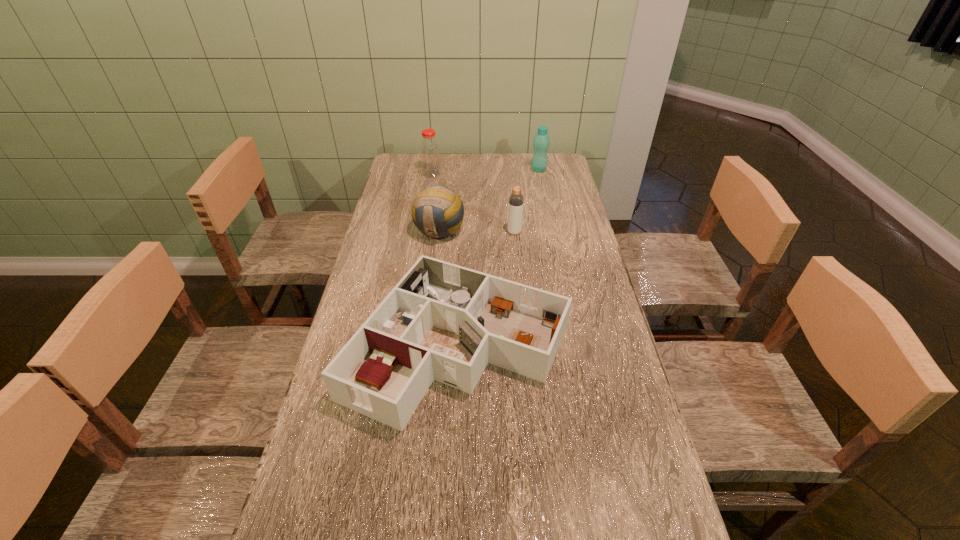
Identify the location of the leftmost bottle. Image resolution: width=960 pixels, height=540 pixels. (430, 156).

The height and width of the screenshot is (540, 960). I want to click on the rightmost bottle, so click(x=541, y=142).

Identify the location of the nearest bottle. The height and width of the screenshot is (540, 960). (516, 200).

At what (x,y) coordinates should I click in order to perform the action: click on volleyball. Please return your answer as a coordinate pair (x, y). Looking at the image, I should click on (438, 212).

Where is `the nearest object`? the nearest object is located at coordinates (444, 322).

At what (x,y) coordinates should I click in order to perform the action: click on dollhouse. Please return your answer as a coordinate pair (x, y). Image resolution: width=960 pixels, height=540 pixels. Looking at the image, I should click on click(x=444, y=322).

Identify the location of vacant position located 0.350m on the right of the leftmost bottle. (523, 174).

Image resolution: width=960 pixels, height=540 pixels. I want to click on free space located 0.190m on the front of the rightmost bottle, so click(544, 198).

Identify the location of blank space located on the front of the nearest bottle. (521, 306).

This screenshot has height=540, width=960. What are the coordinates of `free space located 0.390m on the front of the volleyball` in the screenshot? It's located at (427, 336).